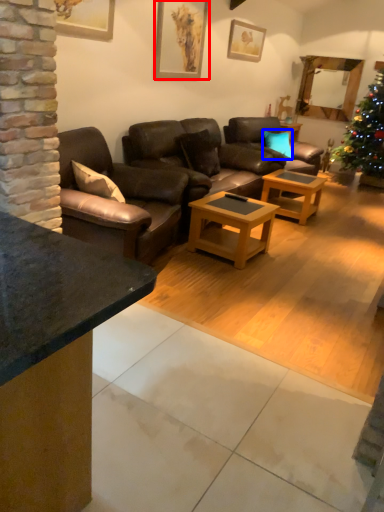
Question: Which object is closer to the camera taking this photo, picture frame (highlighted by a red box) or pillow (highlighted by a blue box)?

Choices:
 (A) picture frame
 (B) pillow

Answer: (A)